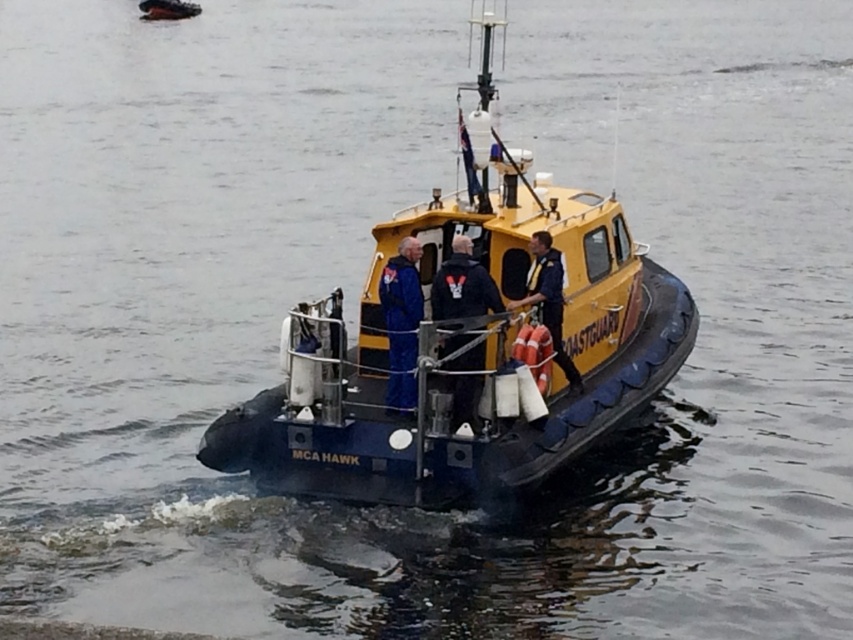
You are on the deck of the coastguard boat and notice a point marked at coordinates (401, 323). What object is located at this point?

The point at coordinates (401, 323) marks the location of the blue fabric jacket at center.

You are an observer on the coastguard boat and need to quickly grab a larger item from the cabin. Which item should you choose between the blue fabric jacket at center and the orange fabric life jacket at center?

The blue fabric jacket at center is bigger than the orange fabric life jacket at center, so you should choose the blue fabric jacket at center.

You are a passenger on the MCA HAWK coastguard boat and need to choose a life jacket. The yellow rubber life jacket at center and the orange fabric life jacket at center are available. Based on their sizes, which one is taller?

The yellow rubber life jacket at center is taller than the orange fabric life jacket at center.